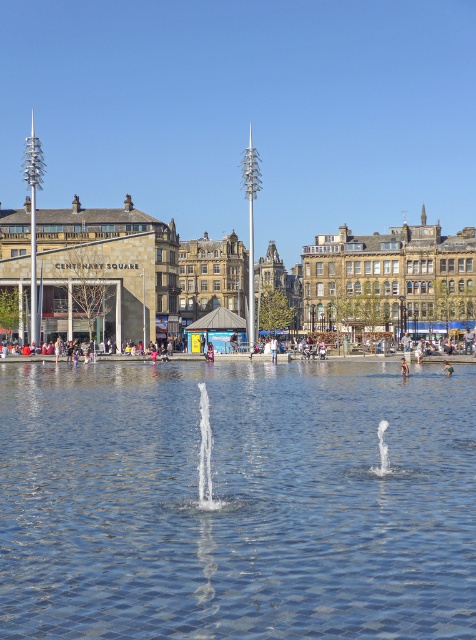
Question: Which object is farther from the camera taking this photo?

Choices:
 (A) clear glass fountain at center
 (B) light blue jeans at center
 (C) green fabric person at center
 (D) white frothy water at center

Answer: (B)

Question: In this image, where is clear water at center located relative to brown stone buildings at center?

Choices:
 (A) left
 (B) right

Answer: (A)

Question: Is clear glass fountain at center wider than green fabric person at center?

Choices:
 (A) no
 (B) yes

Answer: (B)

Question: Estimate the real-world distances between objects in this image. Which object is closer to the green fabric person at center?

Choices:
 (A) white frothy water at center
 (B) tan skin person at center
 (C) light blue jeans at center
 (D) brown stone buildings at center

Answer: (B)

Question: Which point is farther to the camera?

Choices:
 (A) (x=109, y=400)
 (B) (x=71, y=234)
 (C) (x=138, y=358)

Answer: (B)

Question: Can you confirm if light blue jeans at center is positioned to the right of tan skin person at center?

Choices:
 (A) yes
 (B) no

Answer: (B)